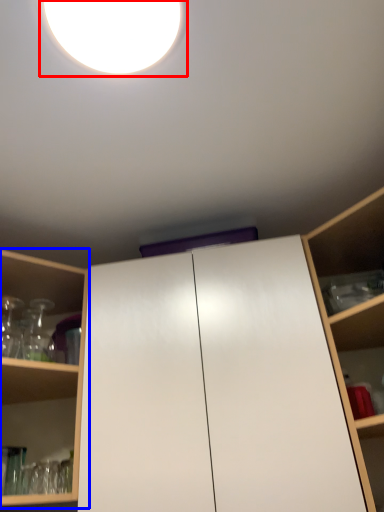
Question: Which object appears closest to the camera in this image, droplight (highlighted by a red box) or shelf (highlighted by a blue box)?

Choices:
 (A) droplight
 (B) shelf

Answer: (A)